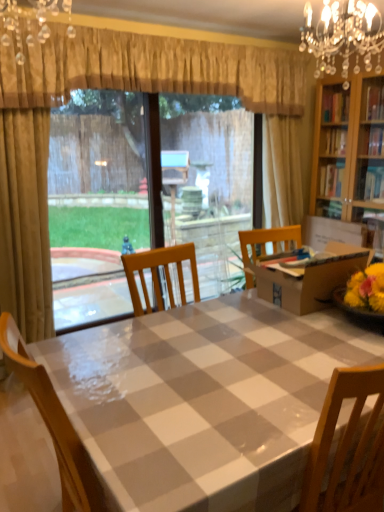
This screenshot has width=384, height=512. What do you see at coordinates (212, 181) in the screenshot?
I see `clear plastic window screen at center` at bounding box center [212, 181].

What do you see at coordinates (153, 69) in the screenshot?
I see `gold textured curtain at upper center` at bounding box center [153, 69].

Find the location of a particular element. The width and height of the screenshot is (384, 512). crystal glass chandelier at upper center, which is the second light fixture in back-to-front order is located at coordinates (13, 25).

Is checkered plastic table at center in front of or behind clear plastic window screen at center in the image?

Visually, checkered plastic table at center is located in front of clear plastic window screen at center.

Can you confirm if checkered plastic table at center is smaller than clear plastic window screen at center?

No, checkered plastic table at center is not smaller than clear plastic window screen at center.

Is checkered plastic table at center facing away from clear plastic window screen at center?

checkered plastic table at center does not have its back to clear plastic window screen at center.

Find the location of a particular element. kitchen & dining room table on the right side of clear plastic window screen at center is located at coordinates (204, 400).

Who is taller, checkered plastic table at center or crystal glass chandelier at upper center, placed as the 1th light fixture when sorted from front to back?

checkered plastic table at center is taller.

From the image's perspective, which is below, checkered plastic table at center or crystal glass chandelier at upper center, placed as the 1th light fixture when sorted from front to back?

checkered plastic table at center, from the image's perspective.

Is checkered plastic table at center aimed at crystal glass chandelier at upper center, placed as the 1th light fixture when sorted from front to back?

No, checkered plastic table at center does not turn towards crystal glass chandelier at upper center, placed as the 1th light fixture when sorted from front to back.

Can you confirm if checkered plastic table at center is wider than crystal glass chandelier at upper center, placed as the 1th light fixture when sorted from front to back?

Yes, checkered plastic table at center is wider than crystal glass chandelier at upper center, placed as the 1th light fixture when sorted from front to back.

Locate an element on the screen. The width and height of the screenshot is (384, 512). window screen on the right of crystal glass chandelier at upper center, which is the second light fixture in back-to-front order is located at coordinates click(x=212, y=181).

Is clear plastic window screen at center shorter than crystal glass chandelier at upper center, which is the second light fixture in back-to-front order?

No, clear plastic window screen at center is not shorter than crystal glass chandelier at upper center, which is the second light fixture in back-to-front order.

Considering their positions, is clear plastic window screen at center located in front of or behind crystal glass chandelier at upper center, placed as the 1th light fixture when sorted from front to back?

Clearly, clear plastic window screen at center is behind crystal glass chandelier at upper center, placed as the 1th light fixture when sorted from front to back.

Could you tell me if clear plastic window screen at center is facing crystal glass chandelier at upper center, placed as the 1th light fixture when sorted from front to back?

No, clear plastic window screen at center does not turn towards crystal glass chandelier at upper center, placed as the 1th light fixture when sorted from front to back.

Is gold textured curtain at upper center a part of checkered plastic table at center?

No.

Does checkered plastic table at center have a smaller size compared to gold textured curtain at upper center?

Incorrect, checkered plastic table at center is not smaller in size than gold textured curtain at upper center.

Does checkered plastic table at center have a greater width compared to gold textured curtain at upper center?

Correct, the width of checkered plastic table at center exceeds that of gold textured curtain at upper center.

Would you say checkered plastic table at center is a long distance from gold textured curtain at upper center?

checkered plastic table at center is far away from gold textured curtain at upper center.

Consider the image. From the image's perspective, which one is positioned higher, crystal glass chandelier at upper center, which is the second light fixture in back-to-front order, or checkered plastic table at center?

crystal glass chandelier at upper center, which is the second light fixture in back-to-front order, appears higher in the image.

Where is `kitchen & dining room table that appears below the crystal glass chandelier at upper center, placed as the 2th light fixture when sorted from right to left (from a real-world perspective)`? The image size is (384, 512). kitchen & dining room table that appears below the crystal glass chandelier at upper center, placed as the 2th light fixture when sorted from right to left (from a real-world perspective) is located at coordinates (204, 400).

Considering the sizes of crystal glass chandelier at upper center, placed as the 1th light fixture when sorted from front to back, and checkered plastic table at center in the image, is crystal glass chandelier at upper center, placed as the 1th light fixture when sorted from front to back, bigger or smaller than checkered plastic table at center?

Considering their sizes, crystal glass chandelier at upper center, placed as the 1th light fixture when sorted from front to back, takes up less space than checkered plastic table at center.

Looking at this image, is crystal glass chandelier at upper center, placed as the 1th light fixture when sorted from front to back, oriented away from checkered plastic table at center?

No, crystal glass chandelier at upper center, placed as the 1th light fixture when sorted from front to back, is not facing the opposite direction of checkered plastic table at center.

From the image's perspective, is crystal glass chandelier at upper center, which is the second light fixture in back-to-front order, over clear plastic window screen at center?

Yes, from the image's perspective, crystal glass chandelier at upper center, which is the second light fixture in back-to-front order, is on top of clear plastic window screen at center.

Is clear plastic window screen at center located within crystal glass chandelier at upper center, which is the second light fixture in back-to-front order?

No, clear plastic window screen at center is not inside crystal glass chandelier at upper center, which is the second light fixture in back-to-front order.

In the scene shown: Is crystal glass chandelier at upper center, placed as the 1th light fixture when sorted from front to back, far from clear plastic window screen at center?

Indeed, crystal glass chandelier at upper center, placed as the 1th light fixture when sorted from front to back, is not near clear plastic window screen at center.

Is crystal chandelier at upper right, which is the 1th light fixture in back-to-front order, shorter than gold textured curtain at upper center?

Correct, crystal chandelier at upper right, which is the 1th light fixture in back-to-front order, is not as tall as gold textured curtain at upper center.

Which of these two, crystal chandelier at upper right, which is the first light fixture from right to left, or gold textured curtain at upper center, is bigger?

Bigger between the two is gold textured curtain at upper center.

Are crystal chandelier at upper right, which is the 2th light fixture from left to right, and gold textured curtain at upper center beside each other?

crystal chandelier at upper right, which is the 2th light fixture from left to right, and gold textured curtain at upper center are clearly separated.

Is crystal chandelier at upper right, which is the 1th light fixture in back-to-front order, to the left of gold textured curtain at upper center from the viewer's perspective?

No.

Identify the location of window screen above the checkered plastic table at center (from the image's perspective). The height and width of the screenshot is (512, 384). (212, 181).

Where is `kitchen & dining room table below the crystal glass chandelier at upper center, placed as the 1th light fixture when sorted from left to right (from the image's perspective)`? The height and width of the screenshot is (512, 384). kitchen & dining room table below the crystal glass chandelier at upper center, placed as the 1th light fixture when sorted from left to right (from the image's perspective) is located at coordinates (204, 400).

From the image, which object appears to be farther from crystal glass chandelier at upper center, placed as the 1th light fixture when sorted from left to right, crystal chandelier at upper right, the second light fixture positioned from the front, or clear plastic window screen at center?

clear plastic window screen at center is positioned further to the anchor crystal glass chandelier at upper center, placed as the 1th light fixture when sorted from left to right.

In the scene shown: Estimate the real-world distances between objects in this image. Which object is closer to clear plastic window screen at center, gold textured curtain at upper center or checkered plastic table at center?

gold textured curtain at upper center lies closer to clear plastic window screen at center than the other object.

Looking at the image, which one is located further to gold textured curtain at upper center, checkered plastic table at center or crystal glass chandelier at upper center, placed as the 2th light fixture when sorted from right to left?

checkered plastic table at center is further to gold textured curtain at upper center.

When comparing their distances from gold textured curtain at upper center, does crystal chandelier at upper right, the second light fixture positioned from the front, or crystal glass chandelier at upper center, which is the second light fixture in back-to-front order, seem further?

crystal chandelier at upper right, the second light fixture positioned from the front, is positioned further to the anchor gold textured curtain at upper center.

Estimate the real-world distances between objects in this image. Which object is closer to crystal glass chandelier at upper center, placed as the 2th light fixture when sorted from right to left, gold textured curtain at upper center or clear plastic window screen at center?

gold textured curtain at upper center is closer to crystal glass chandelier at upper center, placed as the 2th light fixture when sorted from right to left.

Based on their spatial positions, is gold textured curtain at upper center or crystal chandelier at upper right, which is the first light fixture from right to left, further from crystal glass chandelier at upper center, placed as the 1th light fixture when sorted from left to right?

crystal chandelier at upper right, which is the first light fixture from right to left, lies further to crystal glass chandelier at upper center, placed as the 1th light fixture when sorted from left to right, than the other object.

Which object lies further to the anchor point crystal chandelier at upper right, which is the first light fixture from right to left, clear plastic window screen at center or crystal glass chandelier at upper center, placed as the 1th light fixture when sorted from front to back?

Based on the image, clear plastic window screen at center appears to be further to crystal chandelier at upper right, which is the first light fixture from right to left.

Which object lies nearer to the anchor point clear plastic window screen at center, checkered plastic table at center or gold textured curtain at upper center?

gold textured curtain at upper center is closer to clear plastic window screen at center.

At what (x,y) coordinates should I click in order to perform the action: click on curtain located between crystal chandelier at upper right, which is the first light fixture from right to left, and clear plastic window screen at center in the depth direction. Please return your answer as a coordinate pair (x, y). Image resolution: width=384 pixels, height=512 pixels. Looking at the image, I should click on coord(153,69).

The image size is (384, 512). I want to click on curtain between crystal glass chandelier at upper center, placed as the 1th light fixture when sorted from left to right, and crystal chandelier at upper right, which is the first light fixture from right to left, so click(x=153, y=69).

Locate an element on the screen. The image size is (384, 512). curtain located between checkered plastic table at center and clear plastic window screen at center in the depth direction is located at coordinates (153, 69).

At what (x,y) coordinates should I click in order to perform the action: click on light fixture between crystal chandelier at upper right, which is the 1th light fixture in back-to-front order, and checkered plastic table at center, in the vertical direction. Please return your answer as a coordinate pair (x, y). Looking at the image, I should click on (13, 25).